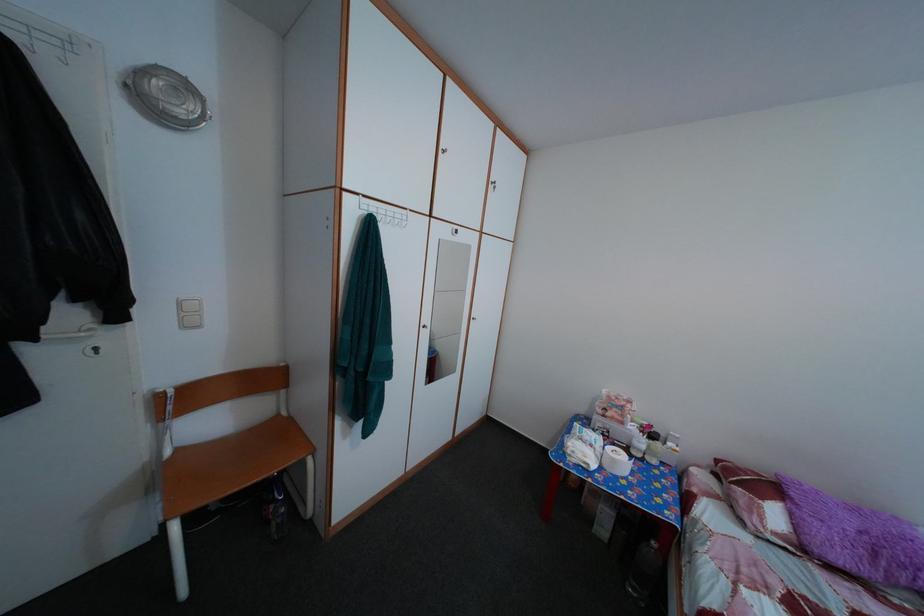
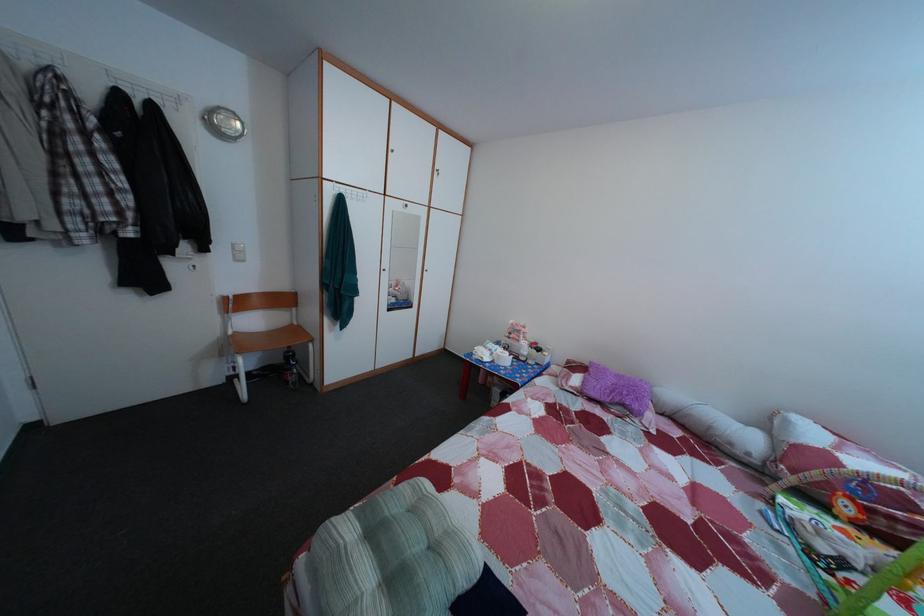
The point at [631,431] is marked in the first image. Where is the corresponding point in the second image?

(528, 349)